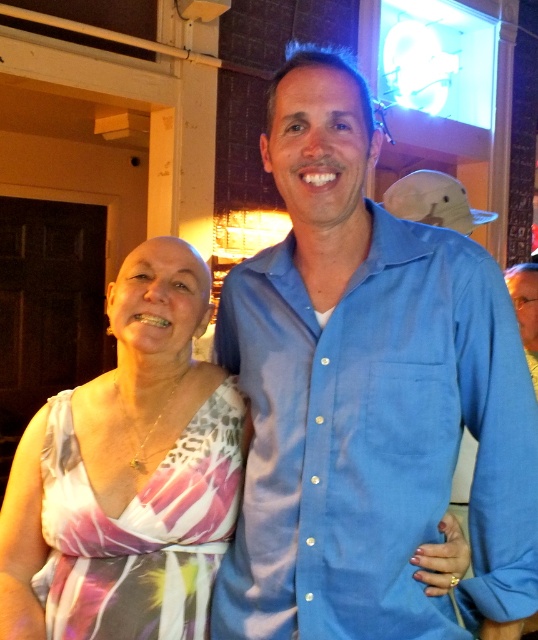
You are a photographer trying to capture a clear photo of both the blue cotton shirt at center and the printed fabric dress at center. Since you want to focus on the larger item, which one should you adjust your camera settings for?

The blue cotton shirt at center is bigger than the printed fabric dress at center, so you should adjust your camera settings to focus on the blue cotton shirt at center.

You are a photographer adjusting your camera settings to focus on the blue cotton shirt at center and the printed fabric dress at center. Which object should you focus on first to ensure both are in sharp focus?

You should focus on the blue cotton shirt at center first because it is closer to the viewer than the printed fabric dress at center, allowing the camera to adjust focus starting from the nearest object.